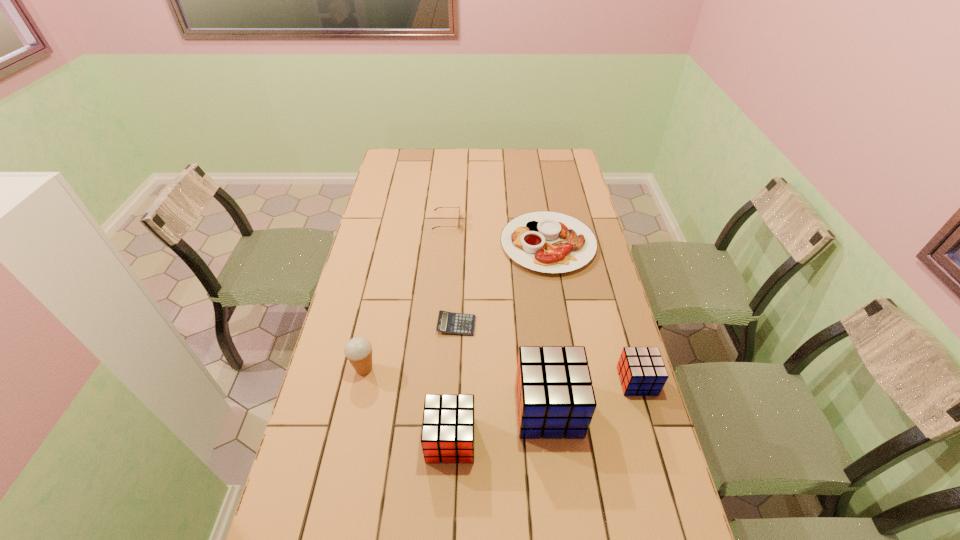
The height and width of the screenshot is (540, 960). What are the coordinates of `free space at the far edge of the desktop` in the screenshot? It's located at (427, 158).

In the image, there is a desktop. Where is `vacant space at the near edge`? The width and height of the screenshot is (960, 540). vacant space at the near edge is located at coordinates (430, 528).

In the image, there is a desktop. Find the location of `vacant space at the left edge`. vacant space at the left edge is located at coordinates (409, 187).

In the image, there is a desktop. Where is `free space at the right edge`? free space at the right edge is located at coordinates point(564,176).

In the image, there is a desktop. Identify the location of blank space at the far right corner. (541, 166).

Where is `blank region between the sixth tallest object and the leftmost object`? This screenshot has width=960, height=540. blank region between the sixth tallest object and the leftmost object is located at coordinates (456, 307).

Where is `free space between the calculator and the leftmost cube`? The height and width of the screenshot is (540, 960). free space between the calculator and the leftmost cube is located at coordinates (453, 382).

Find the location of `free area in between the tallest object and the icecream`. free area in between the tallest object and the icecream is located at coordinates (457, 389).

Where is `free point between the second cube from right to left and the leftmost cube`? Image resolution: width=960 pixels, height=540 pixels. free point between the second cube from right to left and the leftmost cube is located at coordinates click(499, 424).

You are a GUI agent. You are given a task and a screenshot of the screen. Output one action in this format:
    pyautogui.click(x=<x>, y=<y>)
    Task: Click on the free space that is in between the sunglasses and the rightmost cube
    The image size is (960, 540).
    Given the screenshot: What is the action you would take?
    pyautogui.click(x=542, y=301)